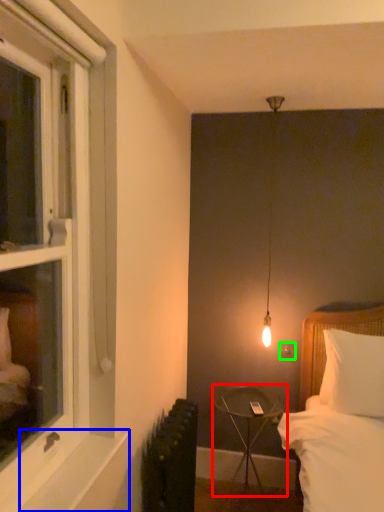
Question: Which object is positioned closest to table (highlighted by a red box)? Select from window sill (highlighted by a blue box) and electric outlet (highlighted by a green box).

Choices:
 (A) window sill
 (B) electric outlet

Answer: (B)